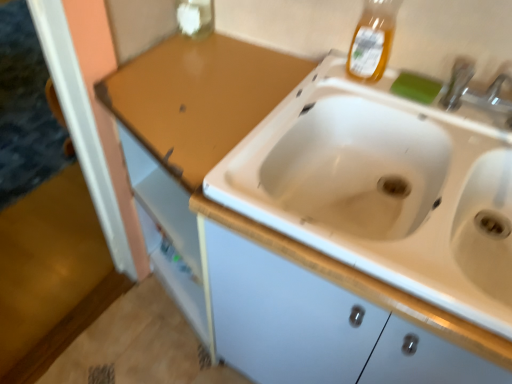
Image resolution: width=512 pixels, height=384 pixels. Find the location of `vacant space to the right of green sponge at upper right`. vacant space to the right of green sponge at upper right is located at coordinates (465, 106).